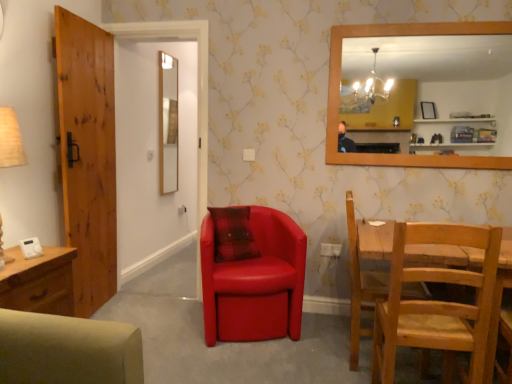
Locate an element on the screen. Image resolution: width=512 pixels, height=384 pixels. empty space that is in between wooden door at left and matte red leather armchair at center, which is the first chair from left to right is located at coordinates pos(159,311).